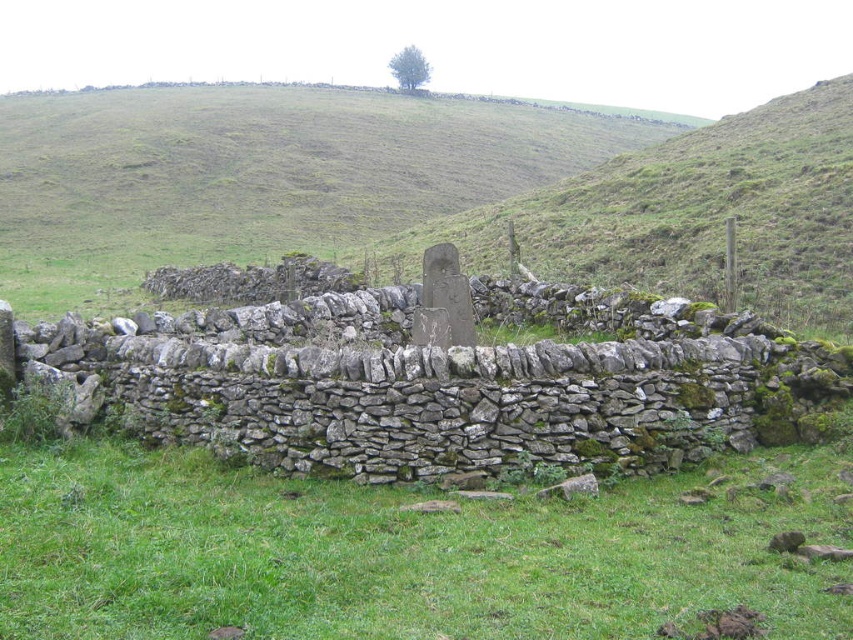
Question: Can you confirm if green grassy hillside at center is wider than green grassy at center?

Choices:
 (A) no
 (B) yes

Answer: (B)

Question: Which point is farther to the camera?

Choices:
 (A) green grassy at center
 (B) green grassy hillside at center

Answer: (B)

Question: Is the position of green grassy hillside at center less distant than that of green grassy at center?

Choices:
 (A) no
 (B) yes

Answer: (A)

Question: Which object is farther from the camera taking this photo?

Choices:
 (A) green grassy at center
 (B) green grassy hillside at center

Answer: (B)

Question: Does green grassy hillside at center have a greater width compared to green grassy at center?

Choices:
 (A) no
 (B) yes

Answer: (B)